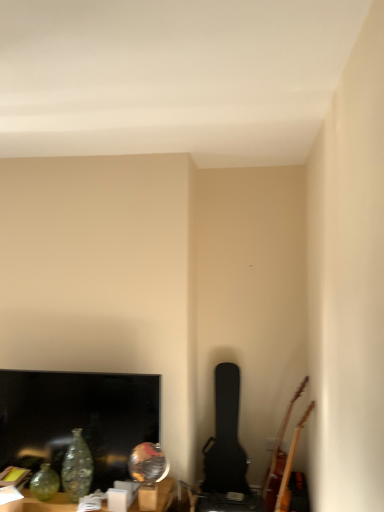
Question: Considering the positions of matte black tv at lower left and black textured guitar case at center-right, which is the 1th guitar from left to right, in the image, is matte black tv at lower left wider or thinner than black textured guitar case at center-right, which is the 1th guitar from left to right,?

Choices:
 (A) thin
 (B) wide

Answer: (A)

Question: From a real-world perspective, is matte black tv at lower left positioned above or below black textured guitar case at center-right, which is the 1th guitar from left to right?

Choices:
 (A) above
 (B) below

Answer: (A)

Question: Based on their relative distances, which object is farther from the wooden acoustic guitar at lower right, arranged as the first guitar when viewed from the right?

Choices:
 (A) matte black tv at lower left
 (B) translucent glass vase at lower left
 (C) black textured guitar case at center-right, which is the 1th guitar from left to right
 (D) translucent glass vase at lower left

Answer: (A)

Question: Estimate the real-world distances between objects in this image. Which object is closer to the matte black tv at lower left?

Choices:
 (A) translucent glass vase at lower left
 (B) translucent glass vase at lower left
 (C) wooden acoustic guitar at lower right, arranged as the first guitar when viewed from the right
 (D) black textured guitar case at center-right, which is the 1th guitar from left to right

Answer: (A)